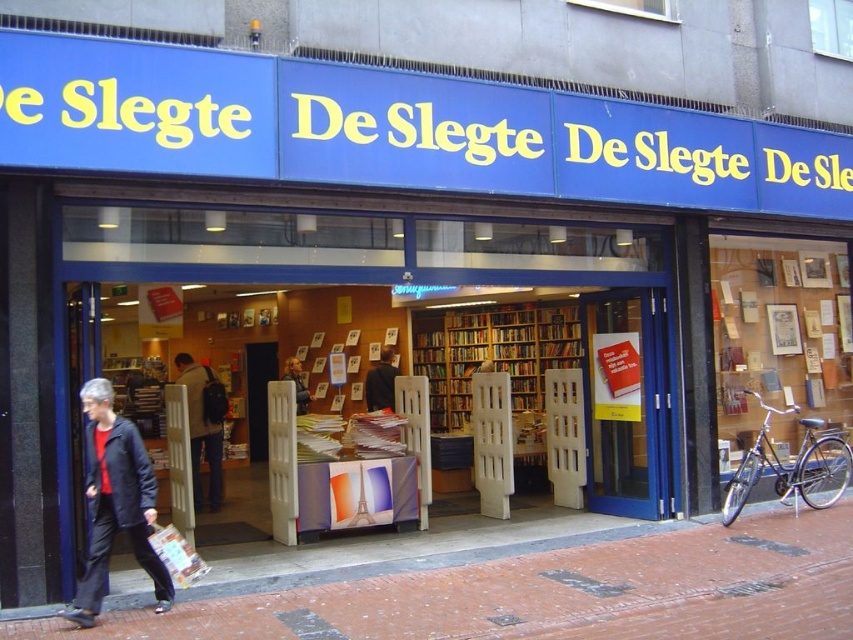
Does dark gray backpack at center have a greater height compared to smooth black jacket at center?

Yes, dark gray backpack at center is taller than smooth black jacket at center.

Does point (196, 435) lie in front of point (299, 404)?

Yes, it is in front of point (299, 404).

Identify the location of dark gray backpack at center. (202, 424).

Who is lower down, wooden bookshelf at center or dark gray backpack at center?

dark gray backpack at center

Does wooden bookshelf at center appear under dark gray backpack at center?

No, wooden bookshelf at center is not below dark gray backpack at center.

Is point (456, 372) behind point (212, 460)?

Yes, point (456, 372) is farther from viewer.

At what (x,y) coordinates should I click in order to perform the action: click on wooden bookshelf at center. Please return your answer as a coordinate pair (x, y). The image size is (853, 640). Looking at the image, I should click on (497, 368).

Can you confirm if black fabric jacket at lower left is positioned to the left of dark gray backpack at center?

In fact, black fabric jacket at lower left is to the right of dark gray backpack at center.

Between black fabric jacket at lower left and dark gray backpack at center, which one is positioned lower?

dark gray backpack at center is below.

Is point (93, 428) positioned after point (206, 374)?

No, it is in front of (206, 374).

Identify the location of black fabric jacket at lower left. (115, 502).